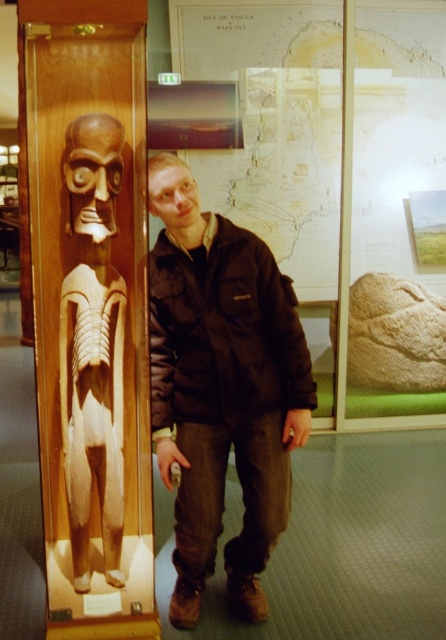
Based on the photo, you are a security guard in the museum and need to ensure that the brown fabric jacket at center and the wooden carving at left are visible through the security camera. The camera can only capture objects taller than 1.2 meters. Which object might be too short to be fully captured?

The wooden carving at left might be too short to be fully captured since the brown fabric jacket at center is taller than it, and if the jacket meets the 1.2 meters requirement, the carving would be shorter and possibly below the camera threshold.

You are standing at point (65,355) in the museum. You want to move to point (193,556). Is the path clear? Please explain.

Point (193,556) is behind point (65,355), so the path is blocked by the latter point. You cannot move directly to point (193,556) from your current position.

Consider the image. You are a security guard in the museum and need to ensure the wooden carving at left is visible through the glass case. The brown fabric jacket at center might be blocking the view. Based on their positions, is the jacket likely blocking the view of the carving?

The brown fabric jacket at center is located below the wooden carving at left, so the jacket is positioned lower than the carving. This means the jacket is unlikely to block the view of the carving since it is below it.